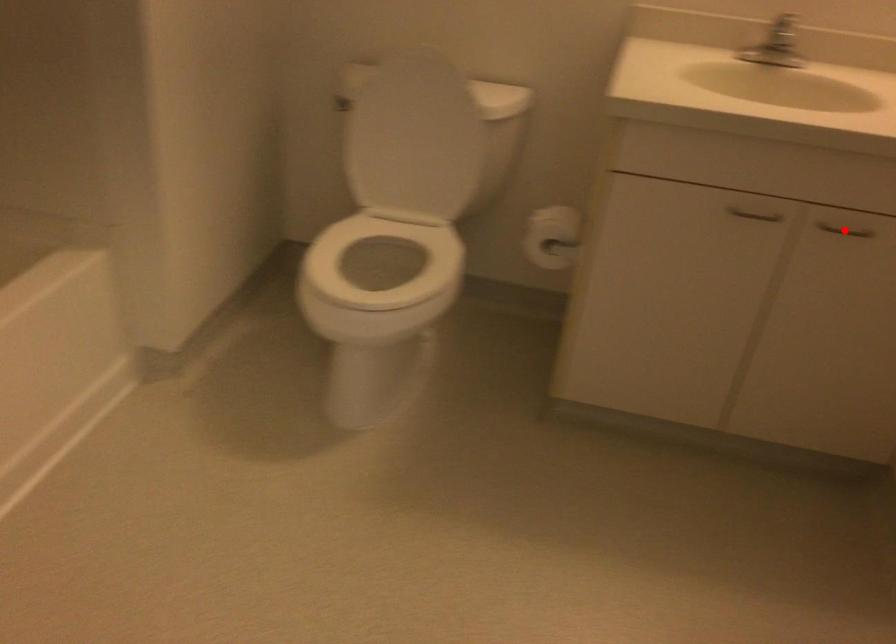
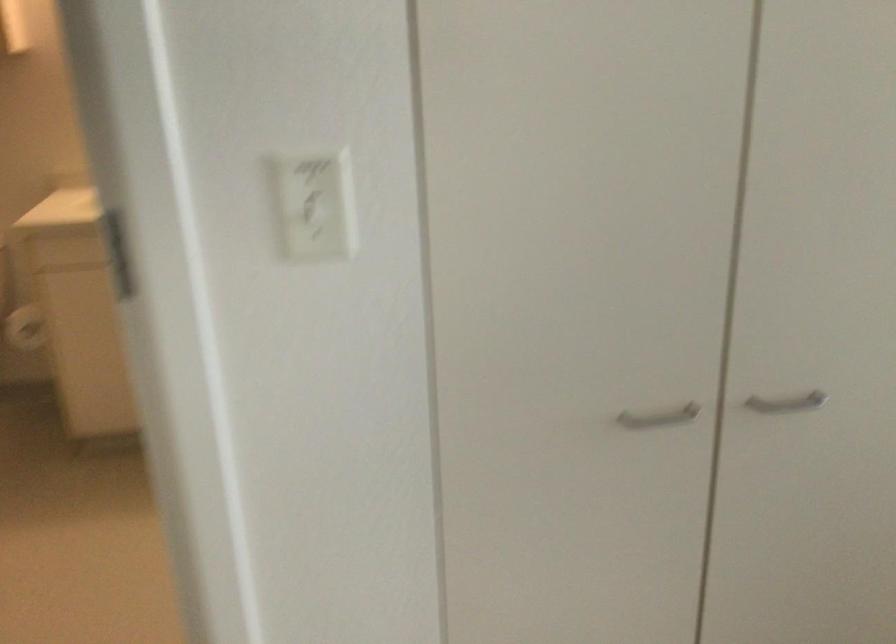
Question: I am providing you with two images of the same scene from different viewpoints. A red point is marked on the first image. Is the red point's position out of view in image 2?

Choices:
 (A) Yes
 (B) No

Answer: (A)